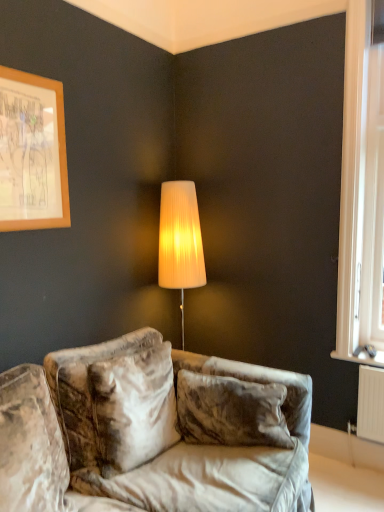
This screenshot has height=512, width=384. What do you see at coordinates (153, 431) in the screenshot?
I see `velvet couch at lower center` at bounding box center [153, 431].

At what (x,y) coordinates should I click in order to perform the action: click on white plastic window at right. Please return your answer as a coordinate pair (x, y). This screenshot has height=512, width=384. Looking at the image, I should click on (361, 193).

Between velvet couch at lower center and white plastic window at right, which one appears on the left side from the viewer's perspective?

Positioned to the left is velvet couch at lower center.

Does velvet couch at lower center turn towards white plastic window at right?

No, velvet couch at lower center is not facing towards white plastic window at right.

From a real-world perspective, which object stands above the other?

white plastic window at right is physically above.

Is velvet couch at lower center at the left side of wooden frame at upper left?

No.

Is point (131, 399) positioned before point (33, 170)?

Yes, point (131, 399) is in front of point (33, 170).

Considering the sizes of velvet couch at lower center and wooden frame at upper left in the image, is velvet couch at lower center taller or shorter than wooden frame at upper left?

Considering their sizes, velvet couch at lower center has more height than wooden frame at upper left.

From a real-world perspective, who is located higher, white plastic window at right or velvet couch at lower center?

white plastic window at right is physically above.

From the picture: Who is taller, white plastic window at right or velvet couch at lower center?

With more height is white plastic window at right.

Considering the sizes of white plastic window at right and velvet couch at lower center in the image, is white plastic window at right bigger or smaller than velvet couch at lower center?

In the image, white plastic window at right appears to be smaller than velvet couch at lower center.

Considering the positions of point (365, 326) and point (3, 464), is point (365, 326) closer or farther from the camera than point (3, 464)?

Clearly, point (365, 326) is more distant from the camera than point (3, 464).

Is point (29, 149) closer or farther from the camera than point (348, 117)?

Point (29, 149).

Is wooden frame at upper left to the left of white plastic window at right from the viewer's perspective?

Yes.

Considering the relative sizes of wooden frame at upper left and white plastic window at right in the image provided, is wooden frame at upper left smaller than white plastic window at right?

Yes.

From the image's perspective, who appears lower, wooden frame at upper left or white plastic window at right?

white plastic window at right appears lower in the image.

Is there a large distance between wooden frame at upper left and velvet couch at lower center?

Yes, wooden frame at upper left is far from velvet couch at lower center.

Measure the distance between wooden frame at upper left and velvet couch at lower center.

3.33 feet.

Is wooden frame at upper left shorter than velvet couch at lower center?

Correct, wooden frame at upper left is not as tall as velvet couch at lower center.

Consider the image. Which is behind, wooden frame at upper left or velvet couch at lower center?

wooden frame at upper left is behind.

Would you say white plastic window at right is outside wooden frame at upper left?

That's correct, white plastic window at right is outside of wooden frame at upper left.

From a real-world perspective, who is located lower, white plastic window at right or wooden frame at upper left?

In real-world perspective, white plastic window at right is lower.

Locate an element on the screen. The image size is (384, 512). window on the right of wooden frame at upper left is located at coordinates (361, 193).

What's the angular difference between white plastic window at right and wooden frame at upper left's facing directions?

The angle between the facing direction of white plastic window at right and the facing direction of wooden frame at upper left is 92 degrees.

Identify the location of window located above the velvet couch at lower center (from the image's perspective). (361, 193).

The height and width of the screenshot is (512, 384). In order to click on picture frame on the left of velvet couch at lower center in this screenshot , I will do `click(32, 153)`.

Considering their positions, is white plastic window at right positioned further to wooden frame at upper left than velvet couch at lower center?

white plastic window at right is positioned further to the anchor wooden frame at upper left.

Based on their spatial positions, is wooden frame at upper left or velvet couch at lower center further from white plastic window at right?

wooden frame at upper left is further to white plastic window at right.

From the picture: Looking at the image, which one is located further to velvet couch at lower center, wooden frame at upper left or white plastic window at right?

Among the two, white plastic window at right is located further to velvet couch at lower center.

When comparing their distances from velvet couch at lower center, does white plastic window at right or wooden frame at upper left seem closer?

Among the two, wooden frame at upper left is located nearer to velvet couch at lower center.

Based on the photo, looking at the image, which one is located closer to wooden frame at upper left, velvet couch at lower center or white plastic window at right?

The object closer to wooden frame at upper left is velvet couch at lower center.

From the image, which object appears to be nearer to white plastic window at right, velvet couch at lower center or wooden frame at upper left?

velvet couch at lower center is positioned closer to the anchor white plastic window at right.

You are a GUI agent. You are given a task and a screenshot of the screen. Output one action in this format:
    pyautogui.click(x=<x>, y=<y>)
    Task: Click on the studio couch located between wooden frame at upper left and white plastic window at right in the left-right direction
    
    Given the screenshot: What is the action you would take?
    pyautogui.click(x=153, y=431)